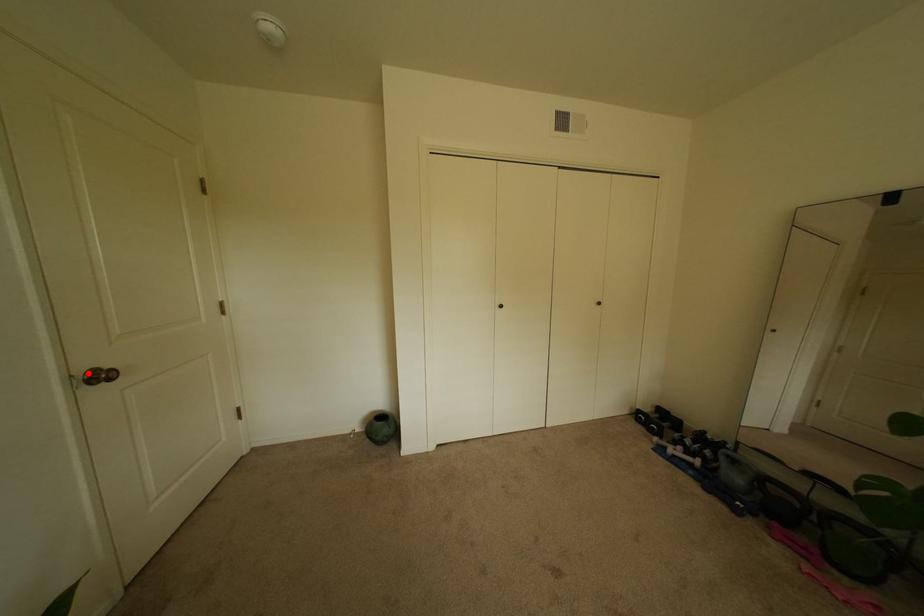
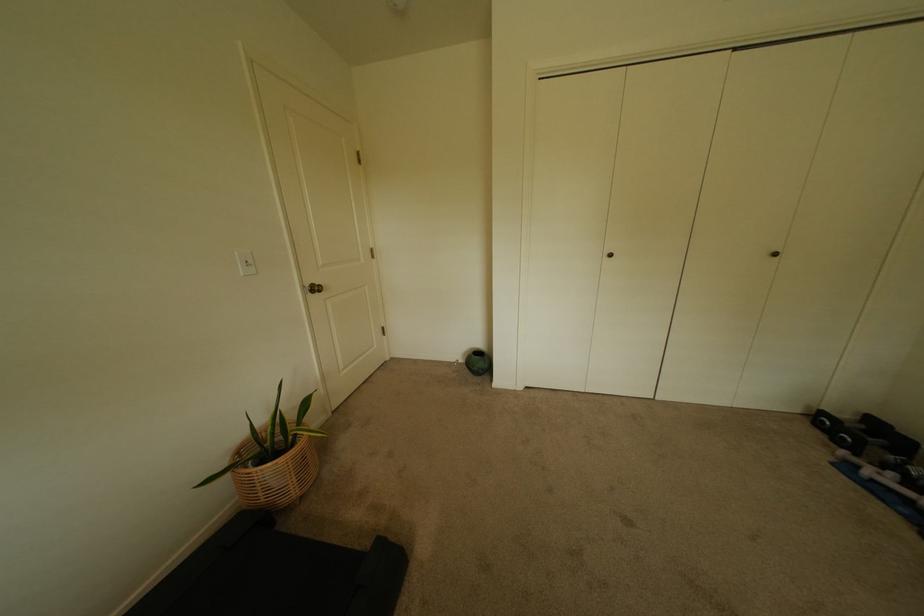
Question: A red point is marked in image1. In image2, is the corresponding 3D point closer to the camera or farther? Reply with the corresponding letter.

Choices:
 (A) The corresponding 3D point is closer.
 (B) The corresponding 3D point is farther.

Answer: (A)